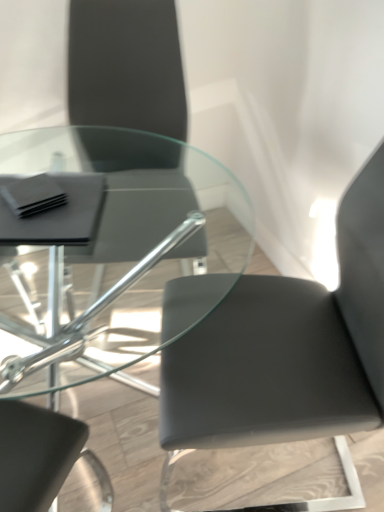
Question: Is matte black chair at upper left, arranged as the first chair when viewed from the left, wider or thinner than matte black chair at center, the second chair viewed from the left?

Choices:
 (A) thin
 (B) wide

Answer: (A)

Question: Choose the correct answer: Is matte black chair at upper left, arranged as the first chair when viewed from the left, inside matte black chair at center, the 1th chair from the right, or outside it?

Choices:
 (A) inside
 (B) outside

Answer: (B)

Question: Based on their sizes in the image, would you say matte black chair at upper left, which appears as the 2th chair when viewed from the right, is bigger or smaller than matte black chair at center, the second chair viewed from the left?

Choices:
 (A) small
 (B) big

Answer: (A)

Question: From a real-world perspective, is matte black chair at center, the 1th chair from the right, physically located above or below matte black chair at upper left, arranged as the first chair when viewed from the left?

Choices:
 (A) above
 (B) below

Answer: (B)

Question: Visually, is matte black chair at center, the second chair viewed from the left, positioned to the left or to the right of matte black chair at upper left, arranged as the first chair when viewed from the left?

Choices:
 (A) left
 (B) right

Answer: (B)

Question: From the image's perspective, is matte black chair at center, the 1th chair from the right, located above or below matte black chair at upper left, which appears as the 2th chair when viewed from the right?

Choices:
 (A) below
 (B) above

Answer: (A)

Question: In the image, is matte black chair at center, the second chair viewed from the left, positioned in front of or behind matte black chair at upper left, which appears as the 2th chair when viewed from the right?

Choices:
 (A) behind
 (B) front

Answer: (B)